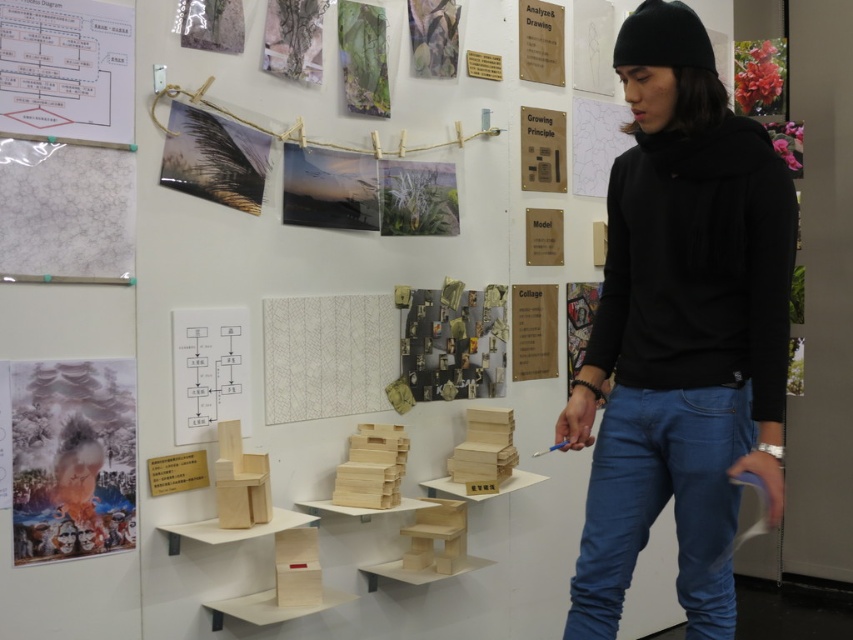
Is black cotton hoodie at upper right closer to the viewer compared to blue denim jeans at lower right?

Yes, it is.

Does black cotton hoodie at upper right have a lesser height compared to blue denim jeans at lower right?

No.

Where is `black cotton hoodie at upper right`? The width and height of the screenshot is (853, 640). black cotton hoodie at upper right is located at coordinates (682, 330).

Which is more to the right, black fleece sweatshirt at right or white paper at upper left?

Positioned to the right is black fleece sweatshirt at right.

Can you confirm if black fleece sweatshirt at right is thinner than white paper at upper left?

No.

Locate an element on the screen. Image resolution: width=853 pixels, height=640 pixels. black fleece sweatshirt at right is located at coordinates (698, 264).

Where is `black cotton hoodie at upper right`? The image size is (853, 640). black cotton hoodie at upper right is located at coordinates (682, 330).

Does black cotton hoodie at upper right have a lesser width compared to white paper at upper left?

In fact, black cotton hoodie at upper right might be wider than white paper at upper left.

Is point (593, 544) farther from viewer compared to point (25, 3)?

No, it is in front of (25, 3).

Where is `black cotton hoodie at upper right`? The height and width of the screenshot is (640, 853). black cotton hoodie at upper right is located at coordinates (682, 330).